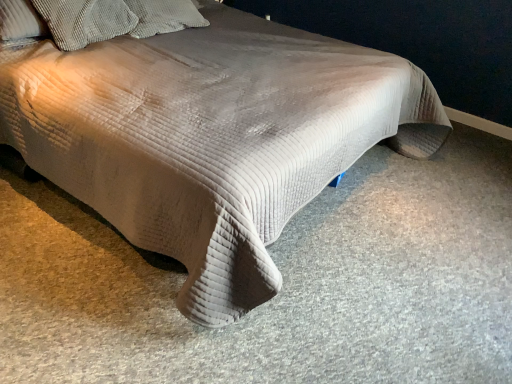
Question: Considering the positions of textured corduroy pillow at upper left, which ranks as the first pillow in right-to-left order, and corduroy pillow at upper left, which appears as the 1th pillow when viewed from the left, in the image, is textured corduroy pillow at upper left, which ranks as the first pillow in right-to-left order, bigger or smaller than corduroy pillow at upper left, which appears as the 1th pillow when viewed from the left,?

Choices:
 (A) small
 (B) big

Answer: (A)

Question: Considering their positions, is textured corduroy pillow at upper left, which ranks as the first pillow in right-to-left order, located in front of or behind corduroy pillow at upper left, which is the second pillow in right-to-left order?

Choices:
 (A) front
 (B) behind

Answer: (B)

Question: From the image's perspective, is textured corduroy pillow at upper left, which ranks as the 2th pillow in left-to-right order, positioned above or below corduroy pillow at upper left, which appears as the 1th pillow when viewed from the left?

Choices:
 (A) below
 (B) above

Answer: (B)

Question: Considering the positions of point (108, 18) and point (137, 3), is point (108, 18) closer or farther from the camera than point (137, 3)?

Choices:
 (A) closer
 (B) farther

Answer: (A)

Question: From the image's perspective, is corduroy pillow at upper left, which appears as the 1th pillow when viewed from the left, above or below textured corduroy pillow at upper left, which ranks as the 2th pillow in left-to-right order?

Choices:
 (A) above
 (B) below

Answer: (B)

Question: Is corduroy pillow at upper left, which appears as the 1th pillow when viewed from the left, to the left or to the right of textured corduroy pillow at upper left, which ranks as the first pillow in right-to-left order, in the image?

Choices:
 (A) right
 (B) left

Answer: (B)

Question: Is corduroy pillow at upper left, which is the second pillow in right-to-left order, wider or thinner than textured corduroy pillow at upper left, which ranks as the 2th pillow in left-to-right order?

Choices:
 (A) thin
 (B) wide

Answer: (A)